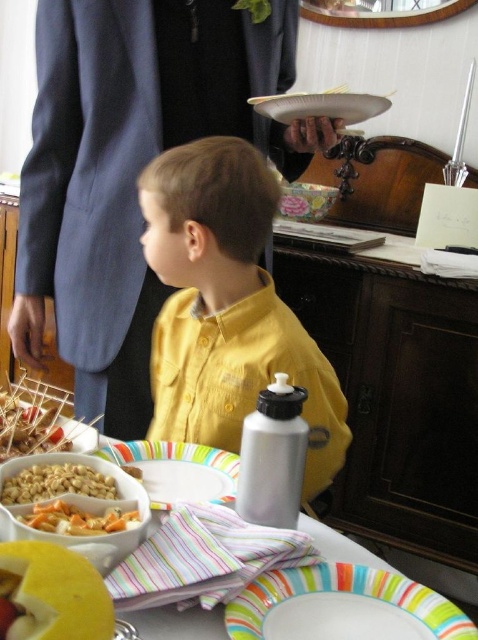
You are at a party and see the crumbly brown cookie at left on the table. If you want to reach it without moving any other items, which direction should you move your hand from your current position?

Since the crumbly brown cookie at left is located at point (29, 424), you should move your hand towards the left side of the table to reach it.

Based on the photo, you are at a party and want to grab a drink from the silver water bottle with a black cap. You are currently standing at the point marked as point (228, 596). Is the silver water bottle with a black cap within reach from this point?

The distance between you at point (228, 596) and the silver water bottle with a black cap is 20.52 inches. Since the average human arm length is about 25 inches, you can comfortably reach it.